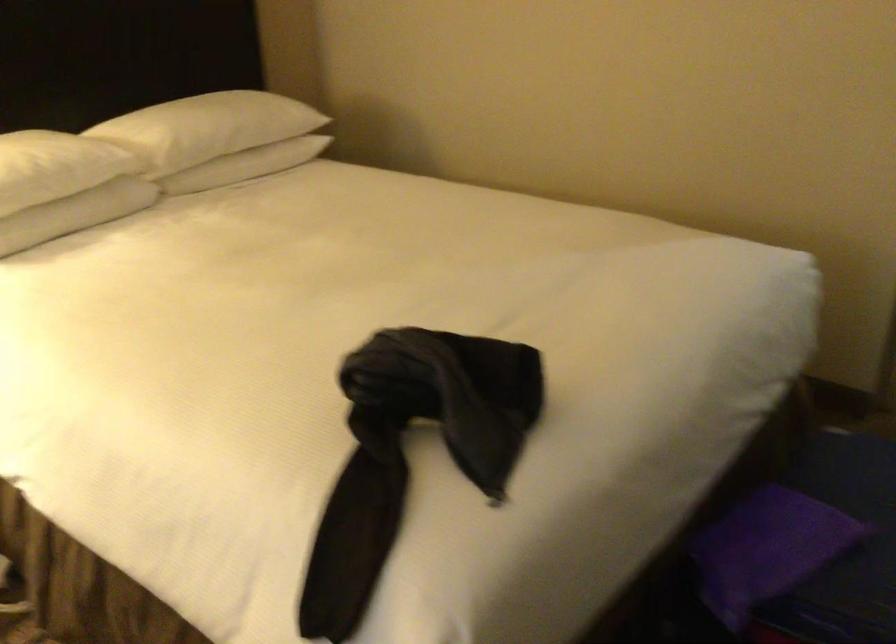
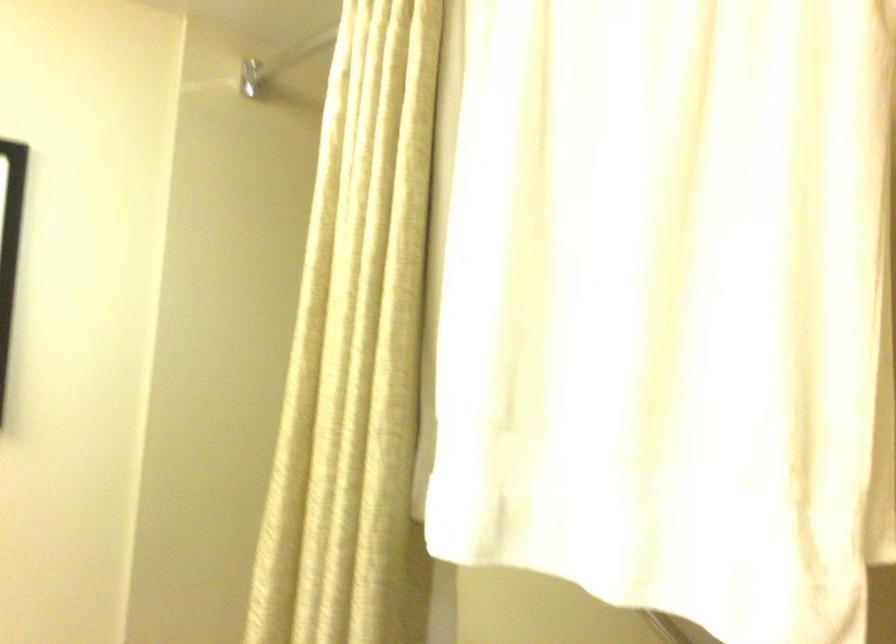
The images are taken continuously from a first-person perspective. In which direction are you moving?

The movement direction of the cameraman is right, forward.